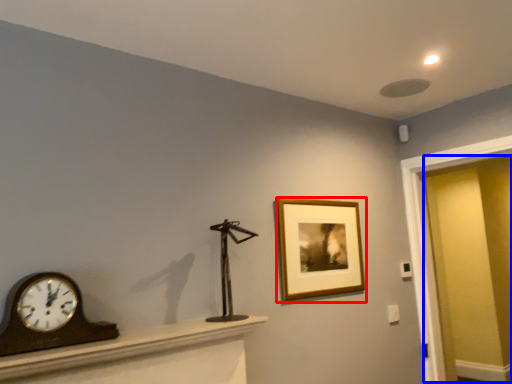
Question: Among these objects, which one is nearest to the camera, picture frame (highlighted by a red box) or glass door (highlighted by a blue box)?

Choices:
 (A) picture frame
 (B) glass door

Answer: (A)